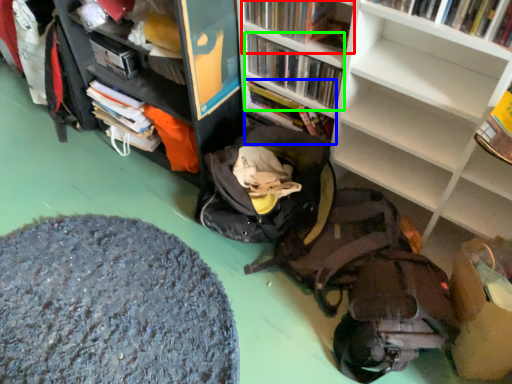
Question: Based on their relative distances, which object is nearer to book (highlighted by a red box)? Choose from book (highlighted by a blue box) and book (highlighted by a green box).

Choices:
 (A) book
 (B) book

Answer: (B)